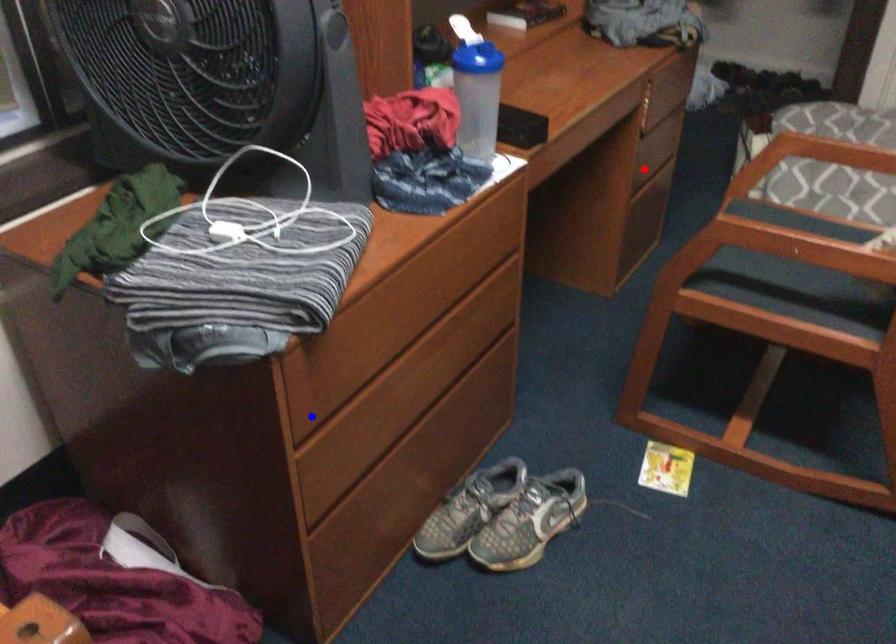
Question: Two points are marked on the image. Which point is closer to the camera?

Choices:
 (A) Blue point is closer.
 (B) Red point is closer.

Answer: (A)